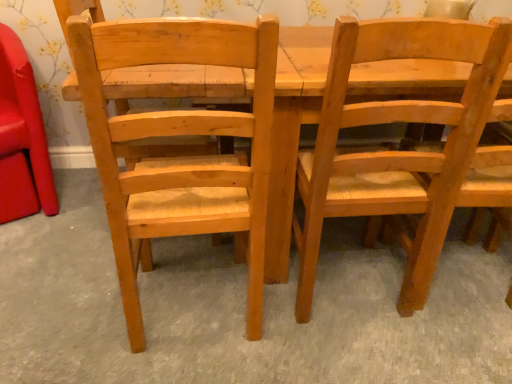
Where is `vacant space underneath natural wood chair at left, which appears as the second chair when viewed from the left (from a real-world perspective)`? This screenshot has height=384, width=512. vacant space underneath natural wood chair at left, which appears as the second chair when viewed from the left (from a real-world perspective) is located at coordinates (195, 302).